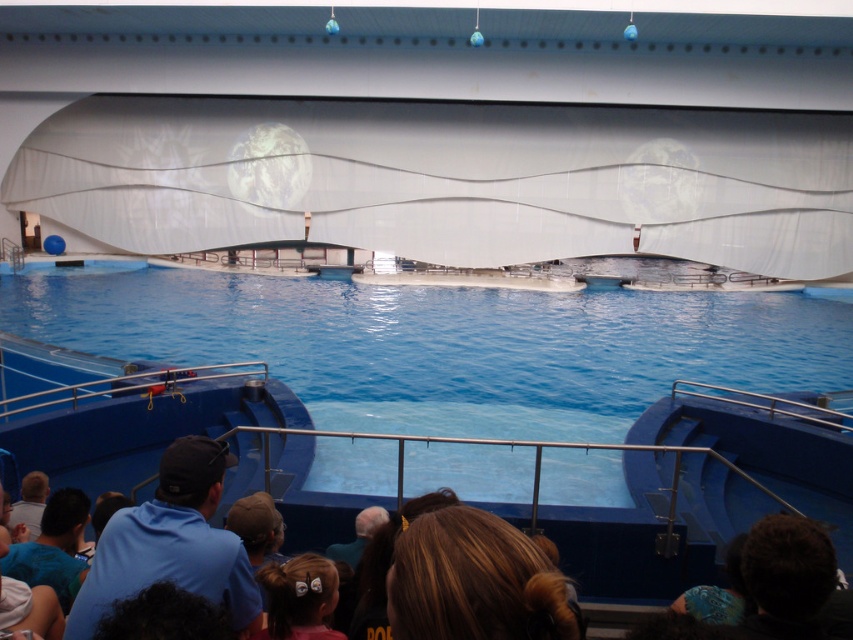
Question: From the image, what is the correct spatial relationship of dark brown hair at lower right in relation to brown hair at lower center?

Choices:
 (A) left
 (B) right

Answer: (B)

Question: Does brown hair at center lie in front of brown hair at lower center?

Choices:
 (A) no
 (B) yes

Answer: (B)

Question: In this image, where is blue smooth water at center located relative to blue cotton hoodie at lower left?

Choices:
 (A) above
 (B) below

Answer: (A)

Question: Which object is positioned closest to the dark brown hair at lower right?

Choices:
 (A) blue shirt at lower left
 (B) blue cotton hoodie at lower left

Answer: (B)

Question: Which object appears farthest from the camera in this image?

Choices:
 (A) blue smooth water at center
 (B) dark brown hair at lower right

Answer: (A)

Question: Which of the following is the closest to the observer?

Choices:
 (A) (270, 509)
 (B) (463, 608)

Answer: (B)